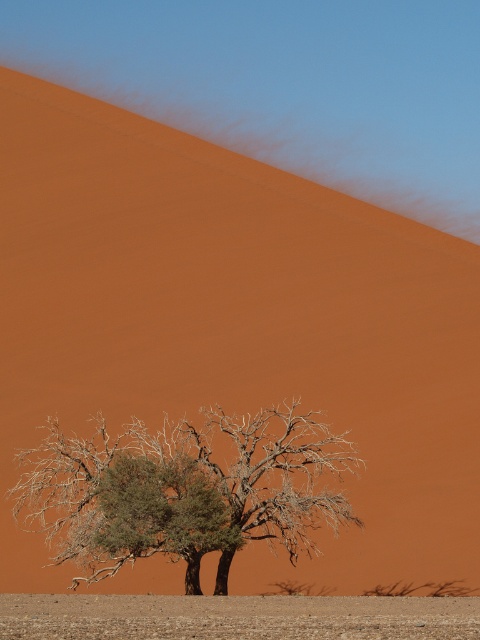
Question: Among these objects, which one is nearest to the camera?

Choices:
 (A) brown sandy ground at lower center
 (B) green leafy tree at lower center

Answer: (A)

Question: Is green leafy tree at lower center in front of brown sandy ground at lower center?

Choices:
 (A) no
 (B) yes

Answer: (A)

Question: Can you confirm if green leafy tree at lower center is bigger than brown sandy ground at lower center?

Choices:
 (A) yes
 (B) no

Answer: (A)

Question: Is green leafy tree at lower center wider than brown sandy ground at lower center?

Choices:
 (A) no
 (B) yes

Answer: (B)